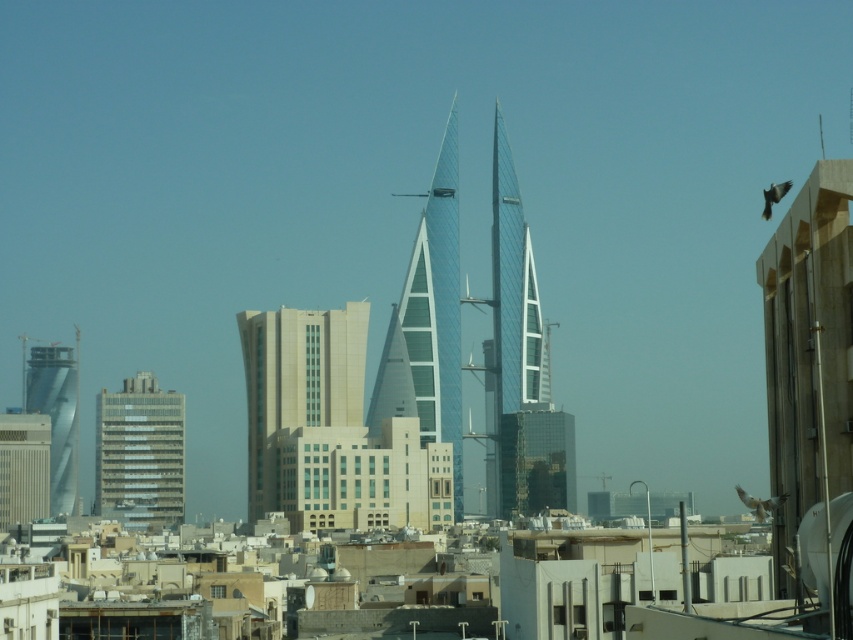
You are standing in the city and want to take a photo of the metallic glass skyscraper at left and the matte gray building at lower left. Which building should you focus on first if you want to capture both in the same frame without moving the camera?

You should focus on the metallic glass skyscraper at left first because it is closer to the viewer than the matte gray building at lower left, so keeping it in focus will also include the matte gray building at lower left in the depth of field.